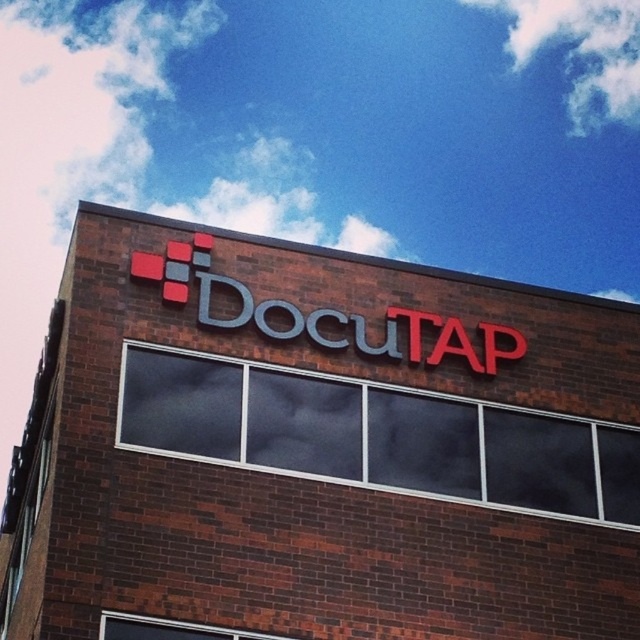
You are standing in front of the building and want to locate the DocuTAP sign. According to the coordinates given, where exactly is the metallic sign at center positioned?

The metallic sign at center is positioned at coordinates point (317, 449).

You are standing in front of the building and want to read both the metallic sign at center and the matte plastic sign at upper center. Which sign should you look at first to read both in order from top to bottom?

You should look at the matte plastic sign at upper center first because it is positioned above the metallic sign at center.

You are a delivery person who needs to attach a package to the sign that is smaller in size. Which sign should you choose between the metallic sign at center and the matte plastic sign at upper center?

The matte plastic sign at upper center is smaller in size compared to the metallic sign at center, so you should choose the matte plastic sign at upper center to attach the package.